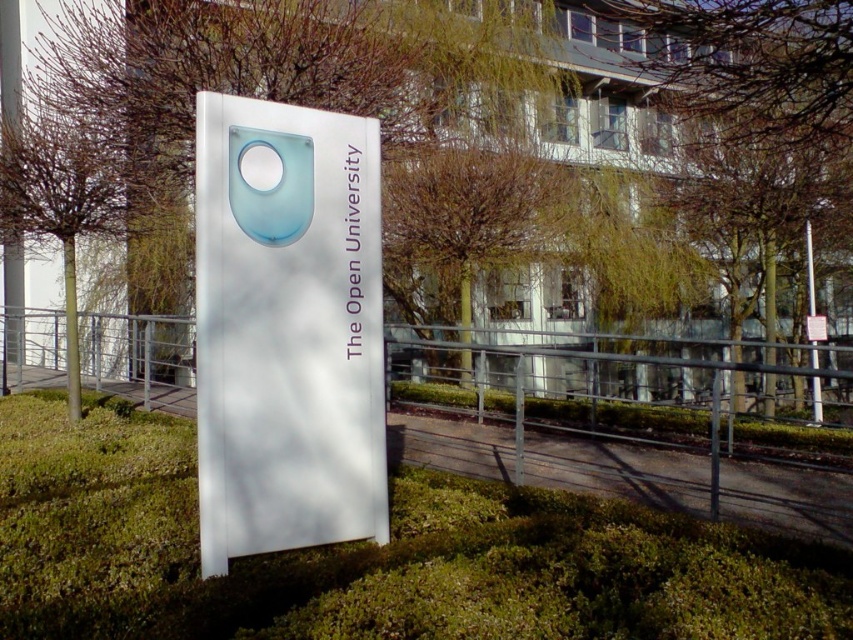
Based on the photo, you are a student walking towards the entrance of The Open University and notice the white glossy sign at center and the translucent blue circle at center. Which object would appear bigger to you as you approach the entrance?

The white glossy sign at center would appear bigger than the translucent blue circle at center as you approach, since it is larger in size according to the description.

You are standing in front of the Open University sign and want to know how far the point at coordinates point (460, 506) is from you. Can you determine the distance?

The point (460, 506) is 4.52 meters from the viewer.